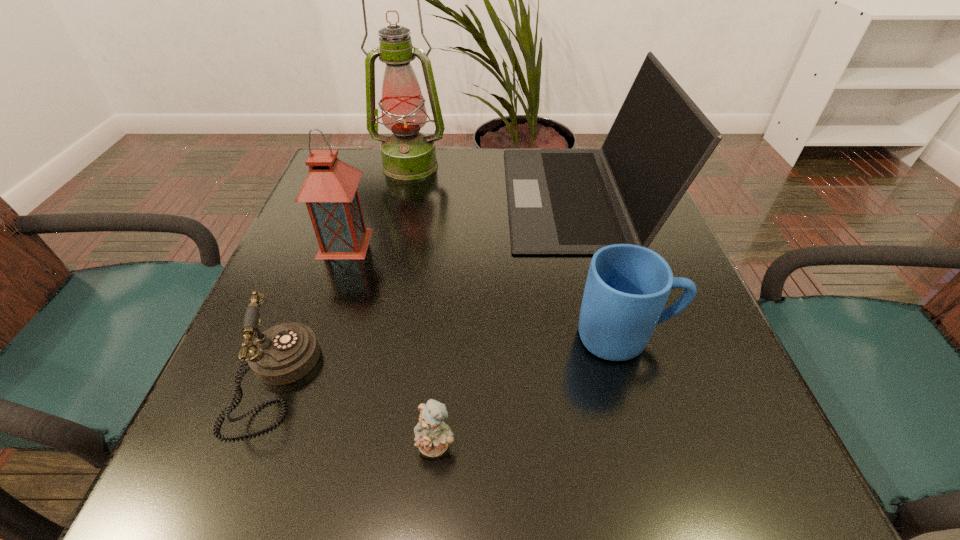
At what (x,y) coordinates should I click in order to perform the action: click on free space located on the back of the lantern. Please return your answer as a coordinate pair (x, y). Looking at the image, I should click on (374, 159).

This screenshot has height=540, width=960. In order to click on vacant space positioned on the right of the telephone in this screenshot , I will do `click(441, 381)`.

What are the coordinates of `oil lamp that is at the far edge` in the screenshot? It's located at (407, 154).

At what (x,y) coordinates should I click in order to perform the action: click on laptop at the far edge. Please return your answer as a coordinate pair (x, y). This screenshot has width=960, height=540. Looking at the image, I should click on (560, 201).

Identify the location of telephone that is at the near edge. (285, 353).

Locate an element on the screen. The image size is (960, 540). teddy bear positioned at the near edge is located at coordinates (432, 435).

Where is `oil lamp positioned at the left edge`? This screenshot has height=540, width=960. oil lamp positioned at the left edge is located at coordinates (407, 154).

Image resolution: width=960 pixels, height=540 pixels. Find the location of `lantern that is at the left edge`. lantern that is at the left edge is located at coordinates click(x=330, y=192).

At what (x,y) coordinates should I click in order to perform the action: click on telephone present at the left edge. Please return your answer as a coordinate pair (x, y). Looking at the image, I should click on 285,353.

At what (x,y) coordinates should I click in order to perform the action: click on laptop that is at the right edge. Please return your answer as a coordinate pair (x, y). The image size is (960, 540). Looking at the image, I should click on (560, 201).